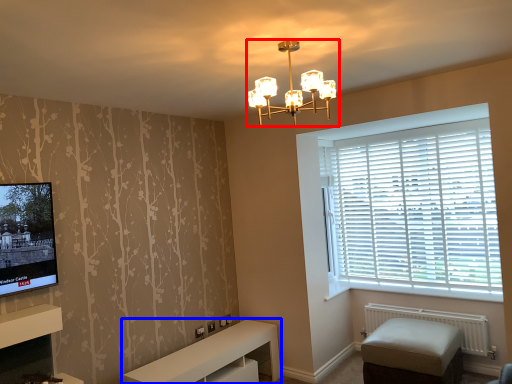
Question: Which object appears closest to the camera in this image, lamp (highlighted by a red box) or furniture (highlighted by a blue box)?

Choices:
 (A) lamp
 (B) furniture

Answer: (A)